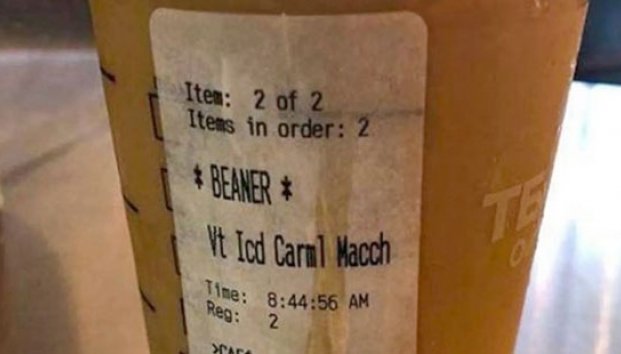
Identify the location of clear plastic cup. (443, 172).